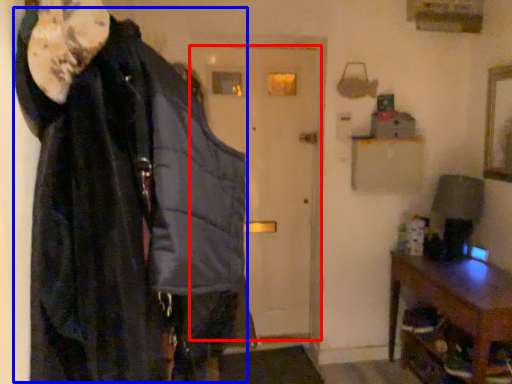
Question: Among these objects, which one is nearest to the camera, door (highlighted by a red box) or cloak (highlighted by a blue box)?

Choices:
 (A) door
 (B) cloak

Answer: (B)